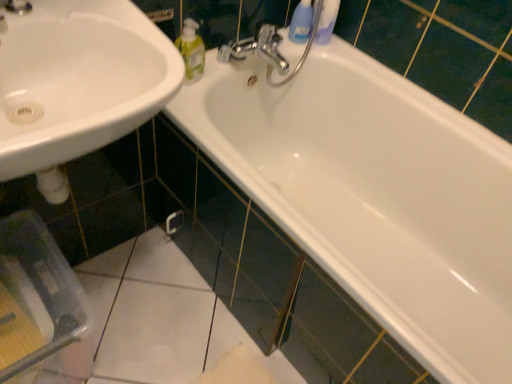
Question: Considering the relative positions of white glossy sink at lower left and chrome metallic faucet at upper center in the image provided, is white glossy sink at lower left to the left or to the right of chrome metallic faucet at upper center?

Choices:
 (A) left
 (B) right

Answer: (A)

Question: Is white glossy sink at lower left taller or shorter than chrome metallic faucet at upper center?

Choices:
 (A) short
 (B) tall

Answer: (B)

Question: Estimate the real-world distances between objects in this image. Which object is closer to the translucent plastic bottle at upper center?

Choices:
 (A) chrome metallic faucet at upper center
 (B) white glossy sink at lower left
 (C) white glossy bathtub at upper center

Answer: (A)

Question: Based on their relative distances, which object is nearer to the chrome metallic faucet at upper center?

Choices:
 (A) white glossy bathtub at upper center
 (B) translucent plastic bottle at upper center
 (C) white glossy sink at lower left

Answer: (B)